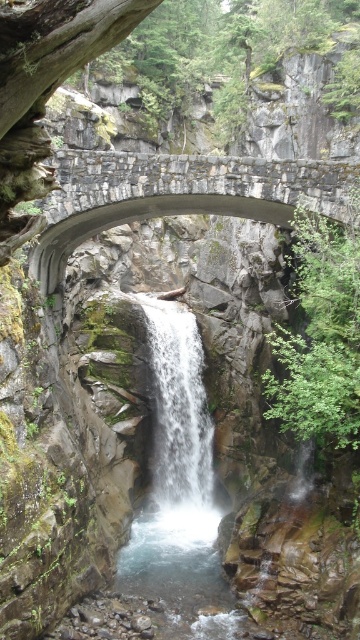
Question: Does rustic stone bridge at center have a lesser width compared to white frothy water at center?

Choices:
 (A) yes
 (B) no

Answer: (B)

Question: Can you confirm if rustic stone bridge at center is wider than white frothy water at center?

Choices:
 (A) no
 (B) yes

Answer: (B)

Question: Which point appears closest to the camera in this image?

Choices:
 (A) (156, 301)
 (B) (129, 170)

Answer: (B)

Question: Does rustic stone bridge at center have a larger size compared to white frothy water at center?

Choices:
 (A) yes
 (B) no

Answer: (A)

Question: Among these objects, which one is nearest to the camera?

Choices:
 (A) white frothy water at center
 (B) rustic stone bridge at center

Answer: (B)

Question: Which of the following is the farthest from the observer?

Choices:
 (A) rustic stone bridge at center
 (B) white frothy water at center

Answer: (B)